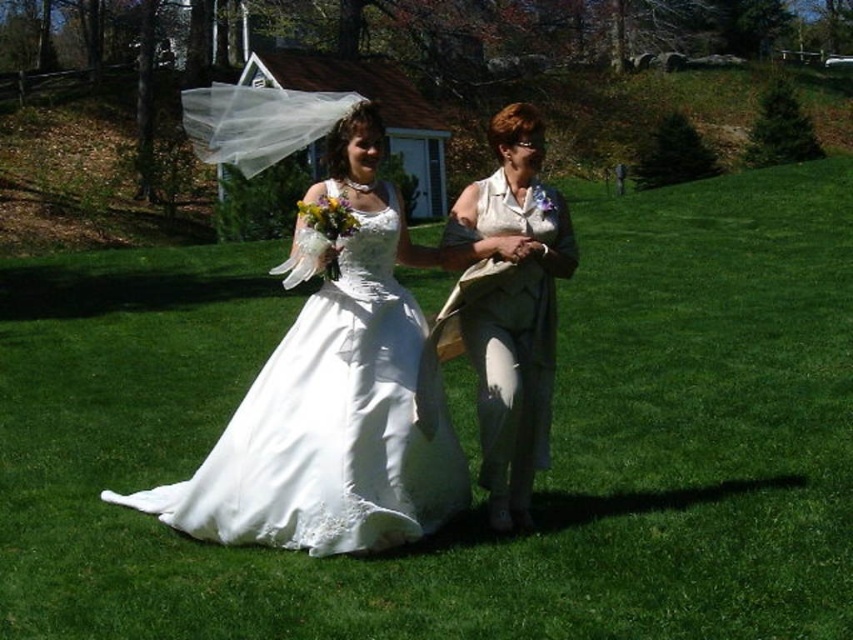
You are a photographer setting up for a group photo. You need to position the white satin dress at center and the matte white blouse at center so that both are clearly visible. Given their sizes, which one should be placed closer to the camera to ensure both are fully visible in the frame?

The white satin dress at center is larger in size than the matte white blouse at center. To ensure both are fully visible, the larger white satin dress at center should be placed closer to the camera while the smaller matte white blouse at center can be positioned slightly further back.

You are standing at the position of the viewer and want to take a photo of the white satin dress at center. If your camera has a maximum focus range of 14 feet, will it be able to capture the dress clearly?

The white satin dress at center is 13.99 feet away from the viewer, which is within the camera maximum focus range of 14 feet. Therefore, the camera can capture the dress clearly.